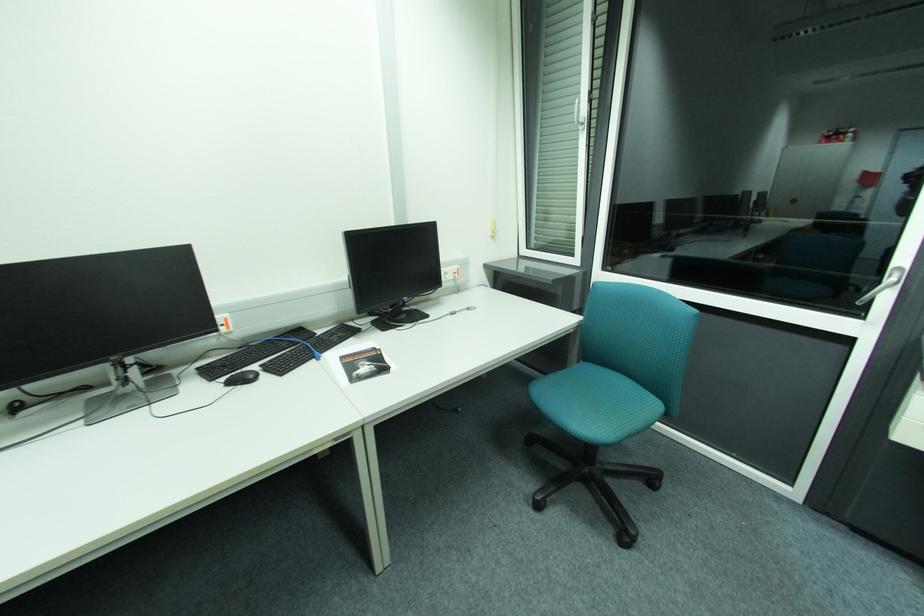
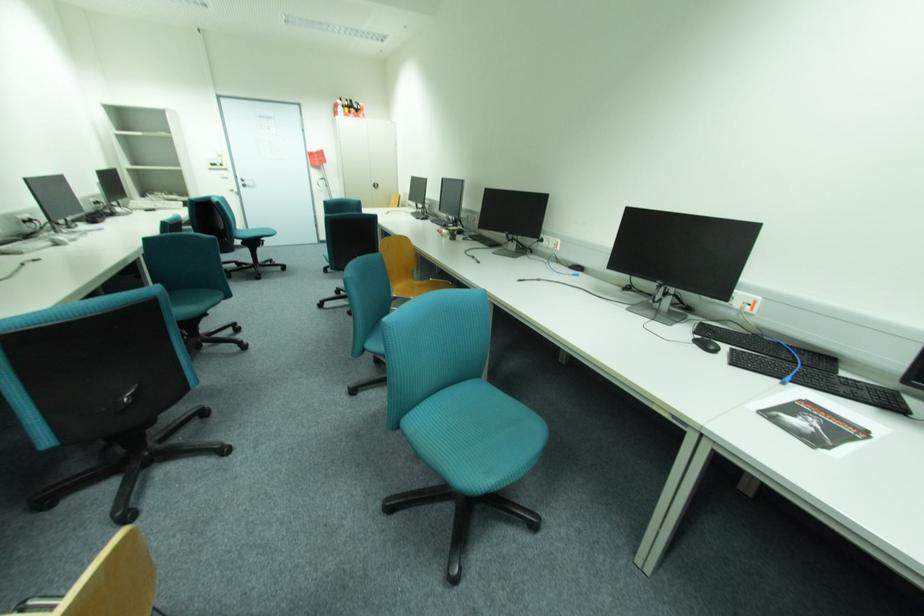
How did the camera likely rotate?

The rotation direction of the camera is left-down.